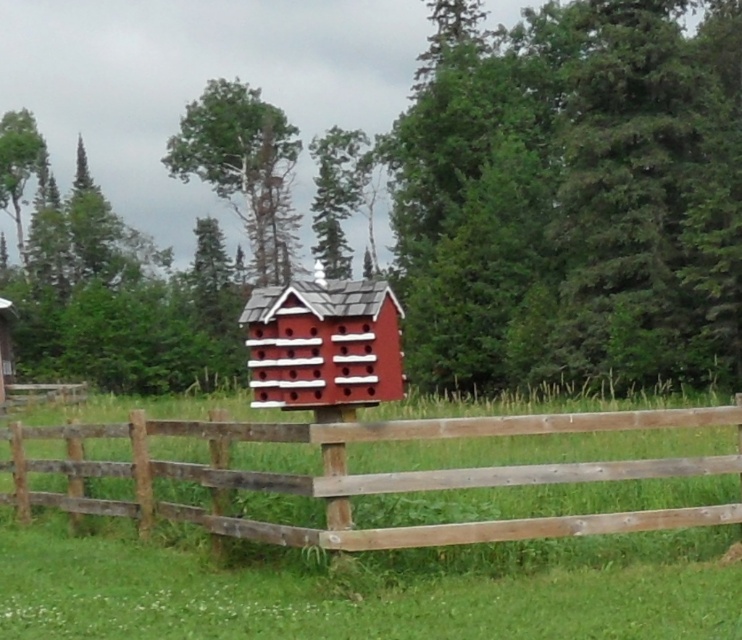
Can you confirm if wooden fence at center is positioned to the left of matte red wooden birdhouse at center?

No, wooden fence at center is not to the left of matte red wooden birdhouse at center.

Between wooden fence at center and matte red wooden birdhouse at center, which one has less height?

wooden fence at center is shorter.

Which is behind, point (347, 477) or point (260, 342)?

Point (260, 342)

Find the location of a particular element. The image size is (742, 640). wooden fence at center is located at coordinates click(364, 474).